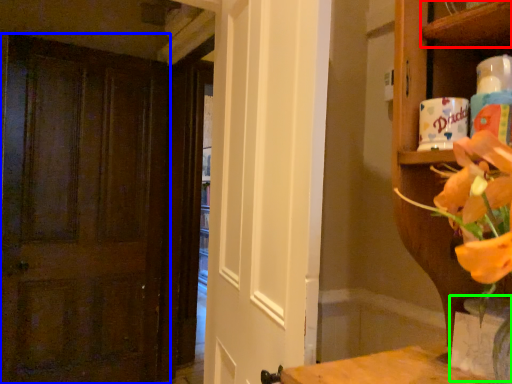
Question: Estimate the real-world distances between objects in this image. Which object is farther from shelf (highlighted by a red box), door (highlighted by a blue box) or vase (highlighted by a green box)?

Choices:
 (A) door
 (B) vase

Answer: (A)